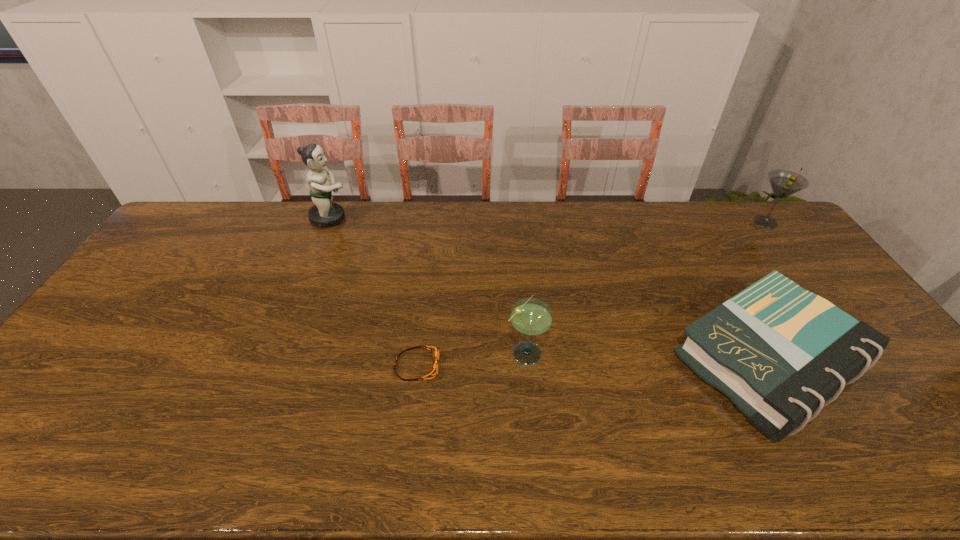
Where is `vacant space that is in between the farther martini and the left martini`? vacant space that is in between the farther martini and the left martini is located at coordinates (645, 286).

At what (x,y) coordinates should I click in order to perform the action: click on vacant area between the figurine and the paperback book. Please return your answer as a coordinate pair (x, y). The height and width of the screenshot is (540, 960). Looking at the image, I should click on (550, 289).

Locate an element on the screen. Image resolution: width=960 pixels, height=540 pixels. vacant area between the fourth object from right to left and the nearer martini is located at coordinates (471, 359).

What are the coordinates of `free area in between the figurine and the farther martini` in the screenshot? It's located at (548, 220).

Find the location of a particular element. The image size is (960, 540). object that is the nearest to the fourth shortest object is located at coordinates (781, 353).

Identify which object is the third nearest to the paperback book. Please provide its 2D coordinates. Your answer should be formatted as a tuple, i.e. [(x, y)], where the tuple contains the x and y coordinates of a point satisfying the conditions above.

[(433, 371)]

Identify the location of free location that satisfies the following two spatial constraints: 1. on the front-facing side of the third object from left to right; 2. on the right side of the tallest object. This screenshot has height=540, width=960. (276, 351).

Identify the location of vacant space that satisfies the following two spatial constraints: 1. on the front-facing side of the right martini; 2. on the left side of the figurine. (328, 222).

Where is `vacant space that satisfies the following two spatial constraints: 1. on the front side of the paperback book; 2. on the left side of the third tallest object`? Image resolution: width=960 pixels, height=540 pixels. vacant space that satisfies the following two spatial constraints: 1. on the front side of the paperback book; 2. on the left side of the third tallest object is located at coordinates (527, 361).

Identify the location of free spot that satisfies the following two spatial constraints: 1. on the front side of the fourth shortest object; 2. with the lenses facing forward on the goggles. (876, 366).